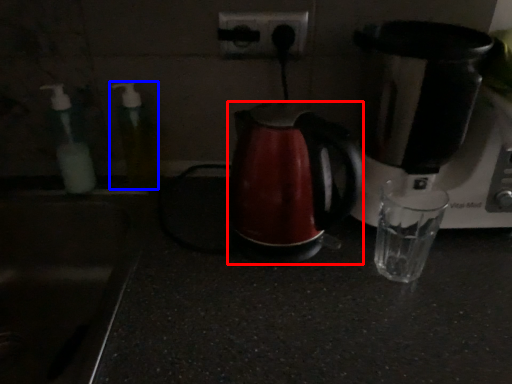
Question: Among these objects, which one is farthest to the camera, kettle (highlighted by a red box) or bottle (highlighted by a blue box)?

Choices:
 (A) kettle
 (B) bottle

Answer: (B)